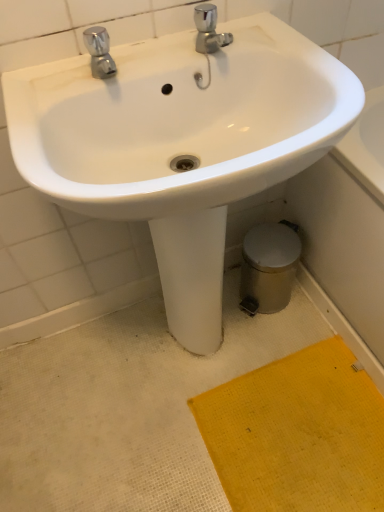
Where is `polished chrome faucet at upper left`? This screenshot has width=384, height=512. polished chrome faucet at upper left is located at coordinates (99, 52).

Find the location of a particular element. This screenshot has height=512, width=384. yellow textured mat at lower right is located at coordinates (298, 434).

You are a GUI agent. You are given a task and a screenshot of the screen. Output one action in this format:
    pyautogui.click(x=<x>, y=<y>)
    Task: Click on the white glossy sink at center
    Image resolution: width=384 pixels, height=512 pixels.
    Given the screenshot: What is the action you would take?
    pyautogui.click(x=58, y=248)

What are the coordinates of `polished chrome faucet at upper left` in the screenshot? It's located at (99, 52).

Does point (95, 60) lie behind point (226, 490)?

No, it is not.

From a real-world perspective, who is located lower, polished chrome faucet at upper left or yellow textured mat at lower right?

yellow textured mat at lower right.

Can we say polished chrome faucet at upper left lies outside yellow textured mat at lower right?

polished chrome faucet at upper left lies outside yellow textured mat at lower right's area.

Where is `doormat that appears on the right of polished chrome faucet at upper left`? This screenshot has width=384, height=512. doormat that appears on the right of polished chrome faucet at upper left is located at coordinates (298, 434).

Considering the sizes of objects white glossy sink at center and yellow textured mat at lower right in the image provided, who is thinner, white glossy sink at center or yellow textured mat at lower right?

white glossy sink at center.

Considering the relative sizes of white glossy sink at center and yellow textured mat at lower right in the image provided, is white glossy sink at center taller than yellow textured mat at lower right?

Yes.

Considering their positions, is white glossy sink at center located in front of or behind yellow textured mat at lower right?

Clearly, white glossy sink at center is in front of yellow textured mat at lower right.

Would you consider white glossy sink at center to be distant from yellow textured mat at lower right?

They are positioned close to each other.

Considering the sizes of objects yellow textured mat at lower right and white glossy sink at center in the image provided, who is wider, yellow textured mat at lower right or white glossy sink at center?

yellow textured mat at lower right is wider.

Does yellow textured mat at lower right have a greater height compared to white glossy sink at center?

Incorrect, the height of yellow textured mat at lower right is not larger of that of white glossy sink at center.

Is yellow textured mat at lower right in front of or behind white glossy sink at center in the image?

In the image, yellow textured mat at lower right appears behind white glossy sink at center.

The width and height of the screenshot is (384, 512). In order to click on sink that appears on the right of polished chrome faucet at upper left in this screenshot , I will do `click(58, 248)`.

In terms of size, does white glossy sink at center appear bigger or smaller than polished chrome faucet at upper left?

Clearly, white glossy sink at center is larger in size than polished chrome faucet at upper left.

Between white glossy sink at center and polished chrome faucet at upper left, which one appears on the left side from the viewer's perspective?

polished chrome faucet at upper left is more to the left.

Is polished chrome faucet at upper left surrounding white glossy sink at center?

No, white glossy sink at center is not surrounded by polished chrome faucet at upper left.

Locate an element on the screen. tap on the left of white glossy sink at center is located at coordinates (99, 52).

From a real-world perspective, which object rests below the other?

From a 3D spatial view, white glossy sink at center is below.

Which object is closer to the camera taking this photo, polished chrome faucet at upper left or white glossy sink at center?

white glossy sink at center is closer to the camera.

Does yellow textured mat at lower right touch polished chrome faucet at upper left?

No, yellow textured mat at lower right is not with polished chrome faucet at upper left.

Is yellow textured mat at lower right to the left of polished chrome faucet at upper left from the viewer's perspective?

No, yellow textured mat at lower right is not to the left of polished chrome faucet at upper left.

Is yellow textured mat at lower right not inside polished chrome faucet at upper left?

Yes.

Considering the sizes of yellow textured mat at lower right and polished chrome faucet at upper left in the image, is yellow textured mat at lower right wider or thinner than polished chrome faucet at upper left?

Considering their sizes, yellow textured mat at lower right looks broader than polished chrome faucet at upper left.

Find the location of `tap above the yellow textured mat at lower right (from the image's perspective)`. tap above the yellow textured mat at lower right (from the image's perspective) is located at coordinates (99, 52).

Identify the location of sink located above the yellow textured mat at lower right (from a real-world perspective). The image size is (384, 512). (58, 248).

From the image, which object appears to be farther from white glossy sink at center, polished chrome faucet at upper left or yellow textured mat at lower right?

Based on the image, yellow textured mat at lower right appears to be further to white glossy sink at center.

Estimate the real-world distances between objects in this image. Which object is further from white glossy sink at center, yellow textured mat at lower right or polished chrome faucet at upper left?

Among the two, yellow textured mat at lower right is located further to white glossy sink at center.

From the image, which object appears to be nearer to polished chrome faucet at upper left, white glossy sink at center or yellow textured mat at lower right?

white glossy sink at center.

Considering their positions, is white glossy sink at center positioned closer to yellow textured mat at lower right than polished chrome faucet at upper left?

The object closer to yellow textured mat at lower right is white glossy sink at center.

Based on their spatial positions, is polished chrome faucet at upper left or white glossy sink at center closer to yellow textured mat at lower right?

The object closer to yellow textured mat at lower right is white glossy sink at center.

When comparing their distances from polished chrome faucet at upper left, does yellow textured mat at lower right or white glossy sink at center seem further?

Based on the image, yellow textured mat at lower right appears to be further to polished chrome faucet at upper left.

I want to click on sink that lies between polished chrome faucet at upper left and yellow textured mat at lower right from top to bottom, so click(x=58, y=248).